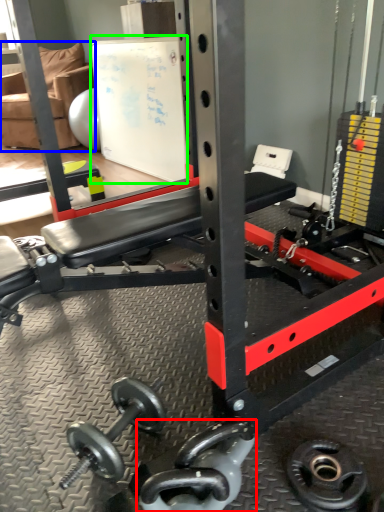
Question: Based on their relative distances, which object is farther from dumbbell (highlighted by a red box)? Choose from chair (highlighted by a blue box) and bulletin board (highlighted by a green box).

Choices:
 (A) chair
 (B) bulletin board

Answer: (A)